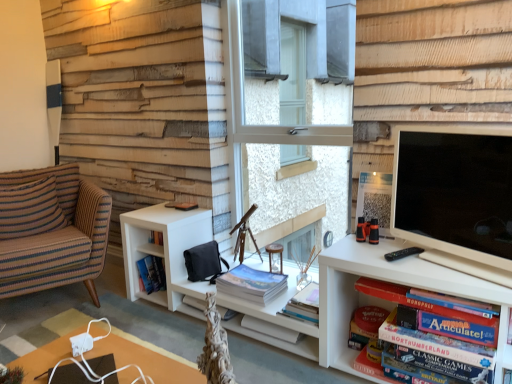
Locate an element on the screen. free point below striped fabric armchair at left (from a real-world perspective) is located at coordinates (56, 302).